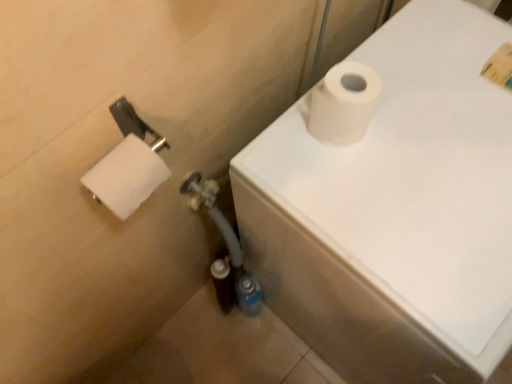
Question: Can you confirm if white matte toilet paper at upper right is thinner than white matte toilet paper at upper right, arranged as the 2th toilet paper when viewed from the left?

Choices:
 (A) yes
 (B) no

Answer: (B)

Question: Considering the relative sizes of white matte toilet paper at upper right and white matte toilet paper at upper right, arranged as the 2th toilet paper when viewed from the left, in the image provided, is white matte toilet paper at upper right shorter than white matte toilet paper at upper right, arranged as the 2th toilet paper when viewed from the left,?

Choices:
 (A) no
 (B) yes

Answer: (A)

Question: From the image's perspective, is white matte toilet paper at upper right located above white matte toilet paper at upper right, arranged as the 2th toilet paper when viewed from the left?

Choices:
 (A) no
 (B) yes

Answer: (A)

Question: Considering the relative sizes of white matte toilet paper at upper right and white matte toilet paper at upper right, acting as the first toilet paper starting from the right, in the image provided, is white matte toilet paper at upper right taller than white matte toilet paper at upper right, acting as the first toilet paper starting from the right,?

Choices:
 (A) yes
 (B) no

Answer: (A)

Question: Is white matte toilet paper at upper right in front of white matte toilet paper at upper right, acting as the first toilet paper starting from the right?

Choices:
 (A) no
 (B) yes

Answer: (B)

Question: Considering the positions of white matte toilet paper at upper right and white matte toilet paper at left, arranged as the first toilet paper when viewed from the left, in the image, is white matte toilet paper at upper right bigger or smaller than white matte toilet paper at left, arranged as the first toilet paper when viewed from the left,?

Choices:
 (A) big
 (B) small

Answer: (A)

Question: Visually, is white matte toilet paper at upper right positioned to the left or to the right of white matte toilet paper at left, which is the 2th toilet paper from right to left?

Choices:
 (A) left
 (B) right

Answer: (B)

Question: Considering the positions of white matte toilet paper at upper right and white matte toilet paper at left, which is the 2th toilet paper from right to left, in the image, is white matte toilet paper at upper right wider or thinner than white matte toilet paper at left, which is the 2th toilet paper from right to left,?

Choices:
 (A) thin
 (B) wide

Answer: (B)

Question: Which is correct: white matte toilet paper at upper right is inside white matte toilet paper at left, which is the 2th toilet paper from right to left, or outside of it?

Choices:
 (A) inside
 (B) outside

Answer: (B)

Question: From a real-world perspective, is white matte toilet paper at upper right, acting as the first toilet paper starting from the right, physically located above or below white matte toilet paper at left, which is the 2th toilet paper from right to left?

Choices:
 (A) below
 (B) above

Answer: (A)

Question: From their relative heights in the image, would you say white matte toilet paper at upper right, arranged as the 2th toilet paper when viewed from the left, is taller or shorter than white matte toilet paper at left, arranged as the first toilet paper when viewed from the left?

Choices:
 (A) short
 (B) tall

Answer: (B)

Question: Is point (318, 94) positioned closer to the camera than point (126, 168)?

Choices:
 (A) closer
 (B) farther

Answer: (B)

Question: In terms of width, does white matte toilet paper at upper right, acting as the first toilet paper starting from the right, look wider or thinner when compared to white matte toilet paper at left, which is the 2th toilet paper from right to left?

Choices:
 (A) thin
 (B) wide

Answer: (B)

Question: Do you think white matte toilet paper at upper right, arranged as the 2th toilet paper when viewed from the left, is within white matte toilet paper at upper right, or outside of it?

Choices:
 (A) inside
 (B) outside

Answer: (B)

Question: From a real-world perspective, is white matte toilet paper at upper right, acting as the first toilet paper starting from the right, positioned above or below white matte toilet paper at upper right?

Choices:
 (A) below
 (B) above

Answer: (B)